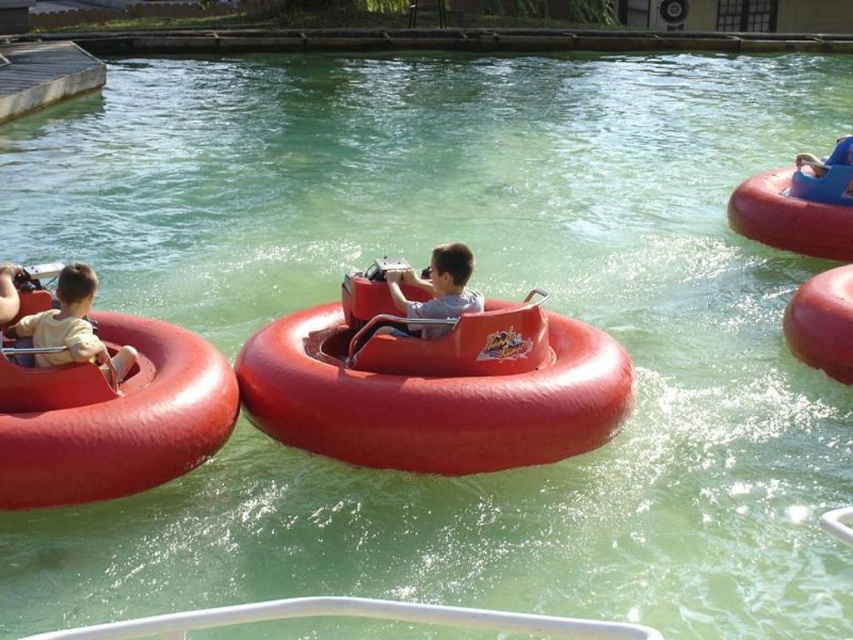
Looking at this image, who is positioned more to the left, rubber boat at center or matte red bumper boat at left?

matte red bumper boat at left is more to the left.

Which is below, rubber boat at center or matte red bumper boat at left?

matte red bumper boat at left

What do you see at coordinates (434, 385) in the screenshot? Image resolution: width=853 pixels, height=640 pixels. I see `rubber boat at center` at bounding box center [434, 385].

The image size is (853, 640). Find the location of `rubber boat at center`. rubber boat at center is located at coordinates (434, 385).

Can you confirm if matte orange life ring at left is wider than matte plastic boat at center?

In fact, matte orange life ring at left might be narrower than matte plastic boat at center.

Does matte orange life ring at left have a smaller size compared to matte plastic boat at center?

Actually, matte orange life ring at left might be larger than matte plastic boat at center.

Does point (99, 355) lie in front of point (422, 307)?

Yes.

At what (x,y) coordinates should I click in order to perform the action: click on matte orange life ring at left. Please return your answer as a coordinate pair (x, y). Image resolution: width=853 pixels, height=640 pixels. Looking at the image, I should click on (73, 328).

At what (x,y) coordinates should I click in order to perform the action: click on rubber boat at center. Please return your answer as a coordinate pair (x, y). The image size is (853, 640). Looking at the image, I should click on (434, 385).

Between rubber boat at center and matte plastic boat at center, which one has less height?

Standing shorter between the two is matte plastic boat at center.

Is point (357, 394) closer to viewer compared to point (448, 288)?

Yes, it is.

Where is `rubber boat at center`? rubber boat at center is located at coordinates (434, 385).